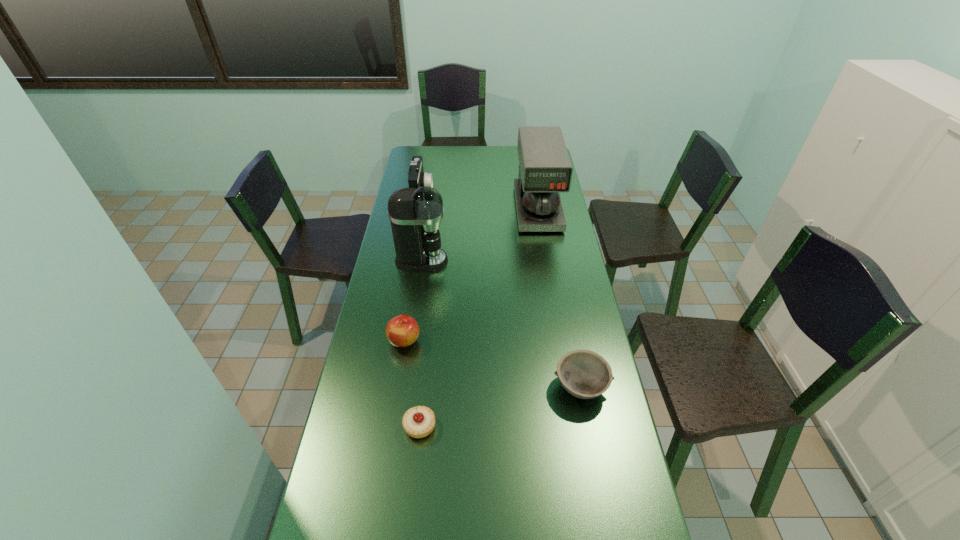
The height and width of the screenshot is (540, 960). In order to click on bowl that is at the right edge in this screenshot , I will do `click(583, 373)`.

Where is `free location at the far edge`? This screenshot has width=960, height=540. free location at the far edge is located at coordinates (499, 147).

Where is `vacant space at the left edge`? The height and width of the screenshot is (540, 960). vacant space at the left edge is located at coordinates (394, 266).

In the image, there is a desktop. At what (x,y) coordinates should I click in order to perform the action: click on vacant space at the right edge. Please return your answer as a coordinate pair (x, y). This screenshot has width=960, height=540. Looking at the image, I should click on click(613, 423).

In the image, there is a desktop. What are the coordinates of `free space at the far left corner` in the screenshot? It's located at (423, 160).

Image resolution: width=960 pixels, height=540 pixels. I want to click on free space between the fourth shortest object and the shortest object, so click(420, 309).

Find the location of `free point between the left coffee maker and the right coffee maker`. free point between the left coffee maker and the right coffee maker is located at coordinates (480, 235).

Locate an element on the screen. Image resolution: width=960 pixels, height=540 pixels. blank region between the third farthest object and the pastry is located at coordinates coord(420,343).

I want to click on empty location between the right coffee maker and the third nearest object, so [471, 275].

Identify the location of free space between the fourth nearest object and the farther coffee maker. (480, 235).